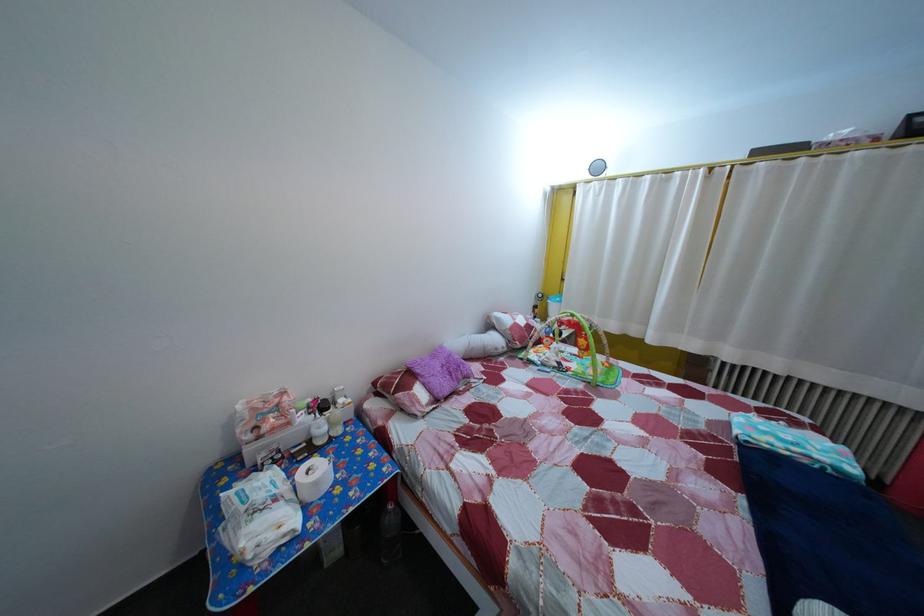
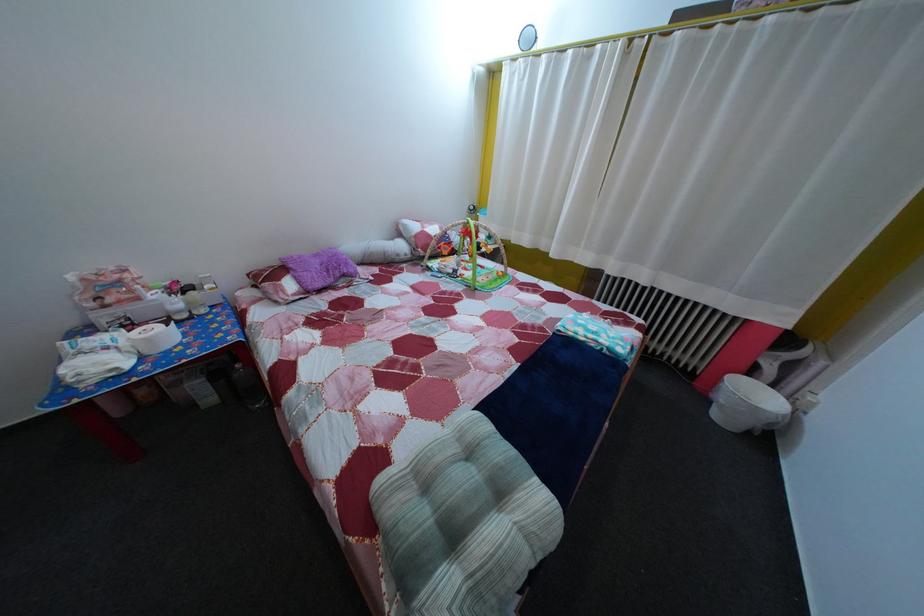
In the second image, find the point that corresponds to [325,491] in the first image.

(157, 347)